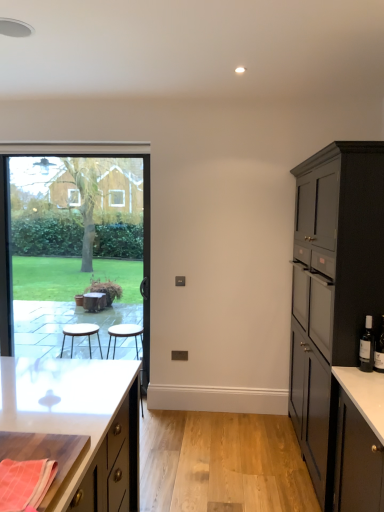
Find the location of a particular element. free space to the back side of orange woven cloth at lower left is located at coordinates (41, 450).